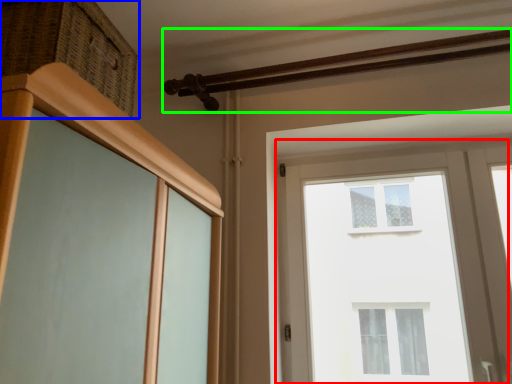
Question: Which object is positioned farthest from window (highlighted by a red box)? Select from drawer (highlighted by a blue box) and rail (highlighted by a green box).

Choices:
 (A) drawer
 (B) rail

Answer: (A)